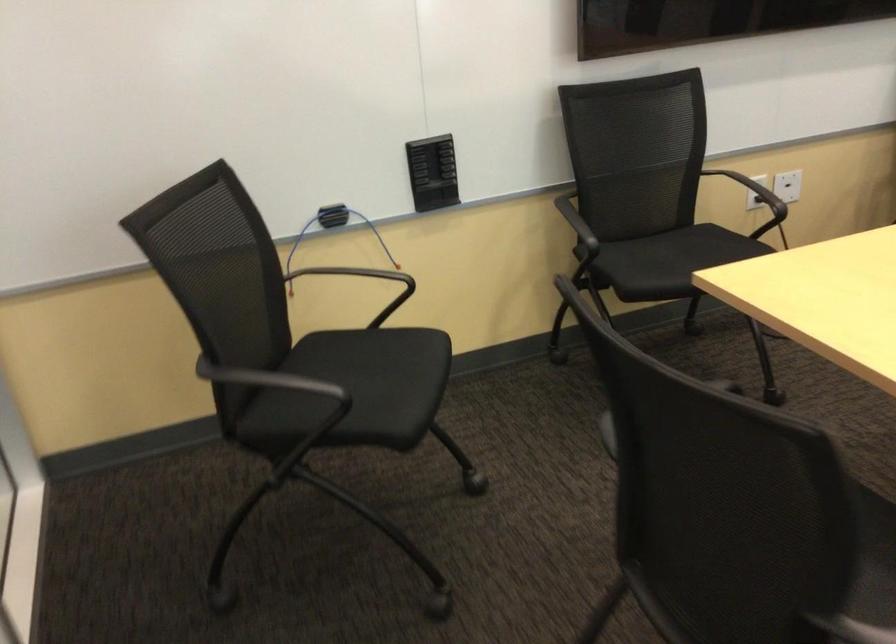
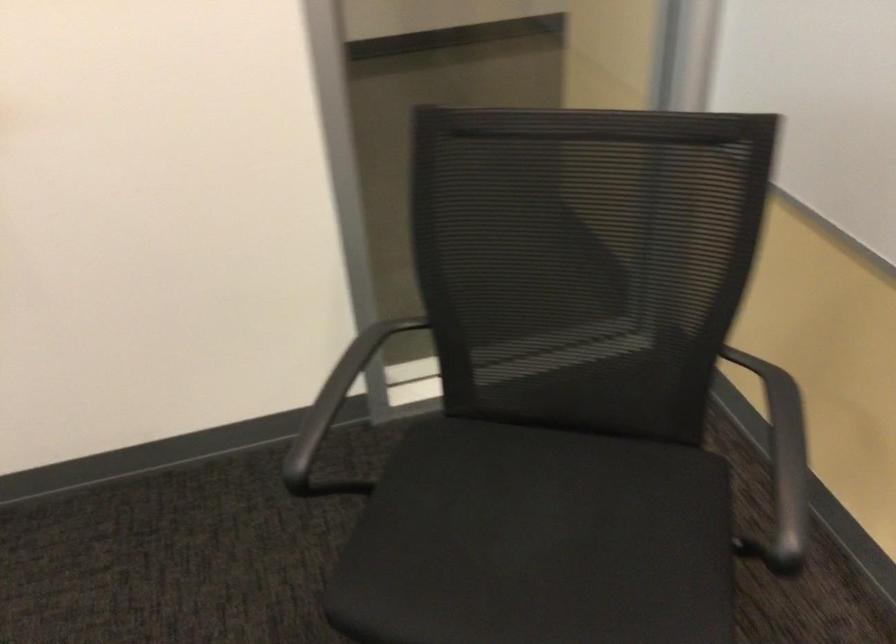
Locate, in the second image, the point that corresponds to the point at 298,377 in the first image.

(330, 415)